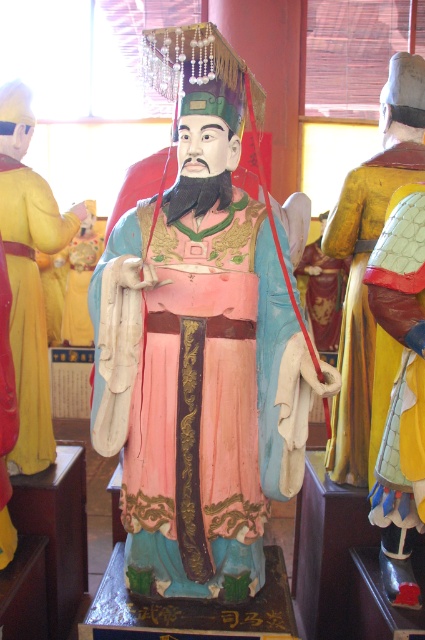
Question: Can you confirm if matte painted statue at center is wider than yellow textured armor at right?

Choices:
 (A) no
 (B) yes

Answer: (B)

Question: Is matte painted statue at center smaller than yellow textured armor at right?

Choices:
 (A) yes
 (B) no

Answer: (B)

Question: Which object is farther from the camera taking this photo?

Choices:
 (A) matte painted statue at center
 (B) yellow textured armor at right

Answer: (B)

Question: Which of these objects is positioned closest to the matte yellow robe at left?

Choices:
 (A) yellow textured armor at right
 (B) matte painted statue at center

Answer: (B)

Question: Is yellow textured armor at right bigger than matte yellow robe at left?

Choices:
 (A) no
 (B) yes

Answer: (B)

Question: Which object is farther from the camera taking this photo?

Choices:
 (A) yellow textured armor at right
 (B) matte yellow robe at left
 (C) matte painted statue at center

Answer: (B)